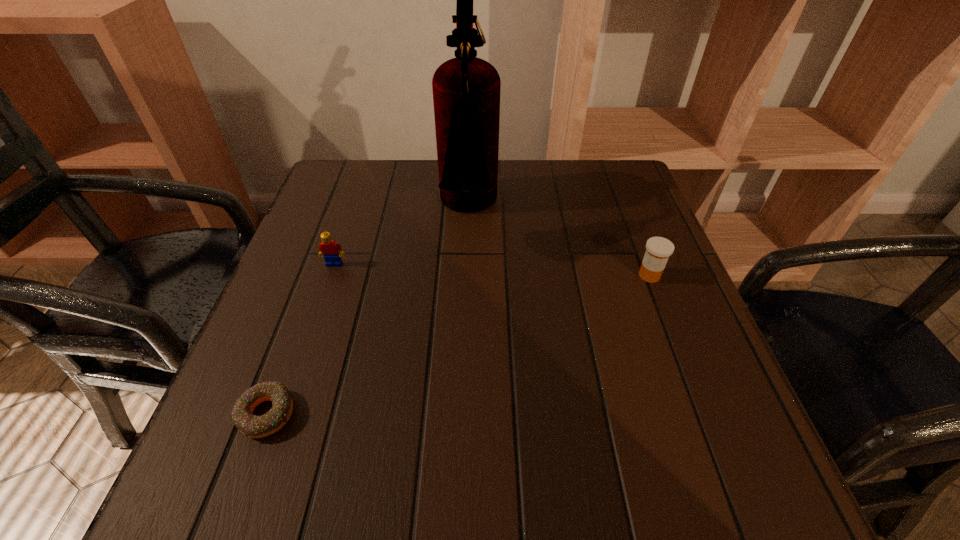
The image size is (960, 540). Identify the location of free space at the near left corner of the desktop. (309, 458).

Where is `free space at the near right corner of the desktop`? free space at the near right corner of the desktop is located at coordinates (726, 446).

Identify the location of vacant area between the shortest object and the medicine. This screenshot has height=540, width=960. (458, 345).

Identify the location of free area in between the second object from right to left and the medicine. This screenshot has width=960, height=540. (559, 242).

At what (x,y) coordinates should I click in order to perform the action: click on empty location between the rightmost object and the nearest object. Please return your answer as a coordinate pair (x, y). The width and height of the screenshot is (960, 540). Looking at the image, I should click on (458, 345).

Where is `vacant area that lies between the fire extinguisher and the Lego`? The height and width of the screenshot is (540, 960). vacant area that lies between the fire extinguisher and the Lego is located at coordinates (401, 237).

In order to click on vacant space in between the third object from left to right and the nearest object in this screenshot , I will do `click(368, 312)`.

Image resolution: width=960 pixels, height=540 pixels. I want to click on free spot between the shortest object and the Lego, so click(300, 339).

You are a GUI agent. You are given a task and a screenshot of the screen. Output one action in this format:
    pyautogui.click(x=<x>, y=<y>)
    Task: Click on the vacant space that's between the Lego and the medicine
    The width and height of the screenshot is (960, 540).
    Given the screenshot: What is the action you would take?
    pyautogui.click(x=492, y=270)

At what (x,y) coordinates should I click in order to perform the action: click on free space between the rightmost object and the tallest object. Please return your answer as a coordinate pair (x, y). Image resolution: width=960 pixels, height=540 pixels. Looking at the image, I should click on (559, 242).